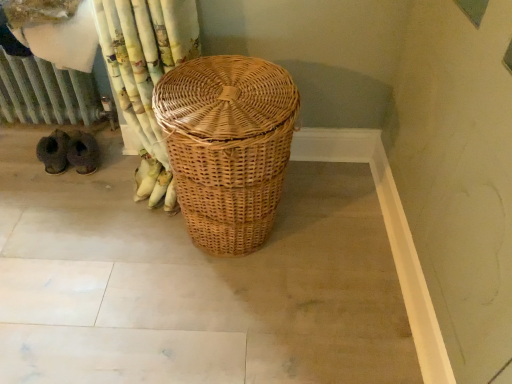
Question: Is metallic radiator at left surrounding natural wicker basket at center?

Choices:
 (A) no
 (B) yes

Answer: (A)

Question: Does metallic radiator at left have a smaller size compared to natural wicker basket at center?

Choices:
 (A) no
 (B) yes

Answer: (B)

Question: Is metallic radiator at left further to camera compared to natural wicker basket at center?

Choices:
 (A) yes
 (B) no

Answer: (A)

Question: Can you confirm if metallic radiator at left is wider than natural wicker basket at center?

Choices:
 (A) yes
 (B) no

Answer: (A)

Question: Is metallic radiator at left facing towards natural wicker basket at center?

Choices:
 (A) no
 (B) yes

Answer: (A)

Question: From a real-world perspective, is metallic radiator at left under natural wicker basket at center?

Choices:
 (A) yes
 (B) no

Answer: (A)

Question: From the image's perspective, is natural wicker basket at center below metallic radiator at left?

Choices:
 (A) no
 (B) yes

Answer: (B)

Question: Considering the relative sizes of natural wicker basket at center and metallic radiator at left in the image provided, is natural wicker basket at center thinner than metallic radiator at left?

Choices:
 (A) yes
 (B) no

Answer: (A)

Question: Is natural wicker basket at center in front of metallic radiator at left?

Choices:
 (A) yes
 (B) no

Answer: (A)

Question: Is natural wicker basket at center smaller than metallic radiator at left?

Choices:
 (A) yes
 (B) no

Answer: (B)

Question: From a real-world perspective, is natural wicker basket at center located beneath metallic radiator at left?

Choices:
 (A) no
 (B) yes

Answer: (A)

Question: Can you confirm if natural wicker basket at center is positioned to the right of metallic radiator at left?

Choices:
 (A) no
 (B) yes

Answer: (B)

Question: From a real-world perspective, is metallic radiator at left above or below natural wicker basket at center?

Choices:
 (A) below
 (B) above

Answer: (A)